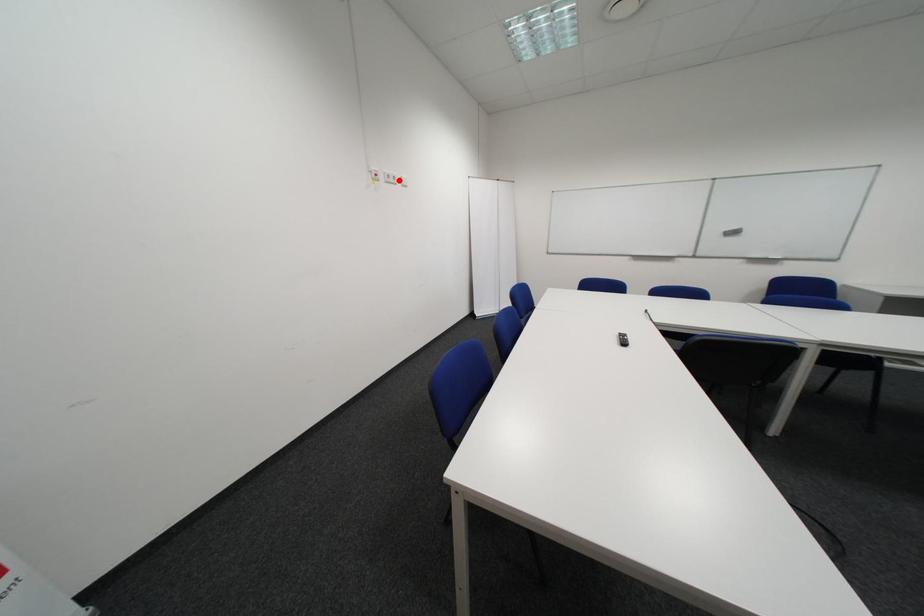
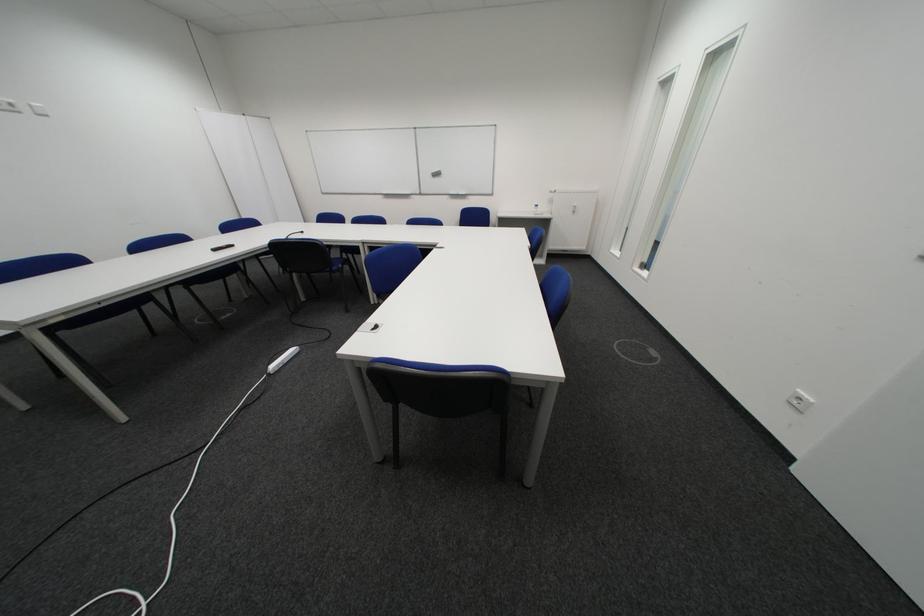
Question: I am providing you with two images of the same scene from different viewpoints. Image1 has a red point marked. In image2, the corresponding 3D location appears at what relative position? Reply with the corresponding letter.

Choices:
 (A) Closer
 (B) Farther

Answer: (B)